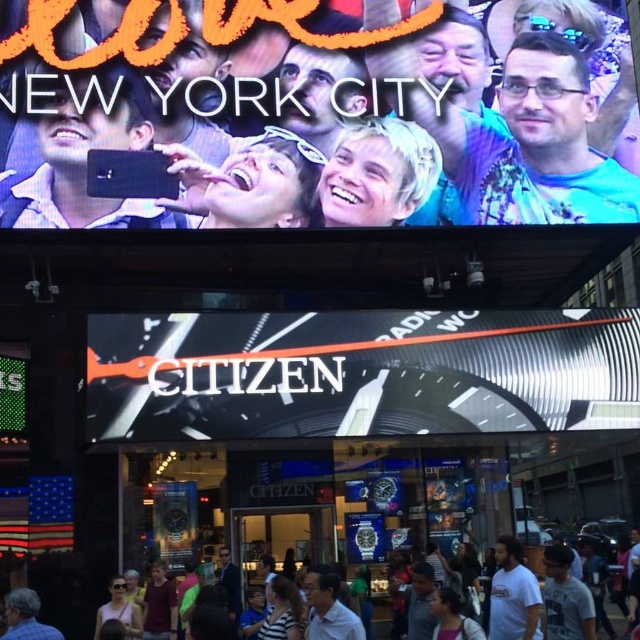
You are a photographer trying to capture the entire scene in one shot. The matte black phone at upper center and the blue denim jeans at lower left are both in your frame. Considering their sizes in the image, which object should you focus on to ensure both fit clearly in the photo?

The blue denim jeans at lower left is smaller than the matte black phone at upper center, so focusing on the larger object, the matte black phone at upper center, will help ensure both fit clearly in the photo.